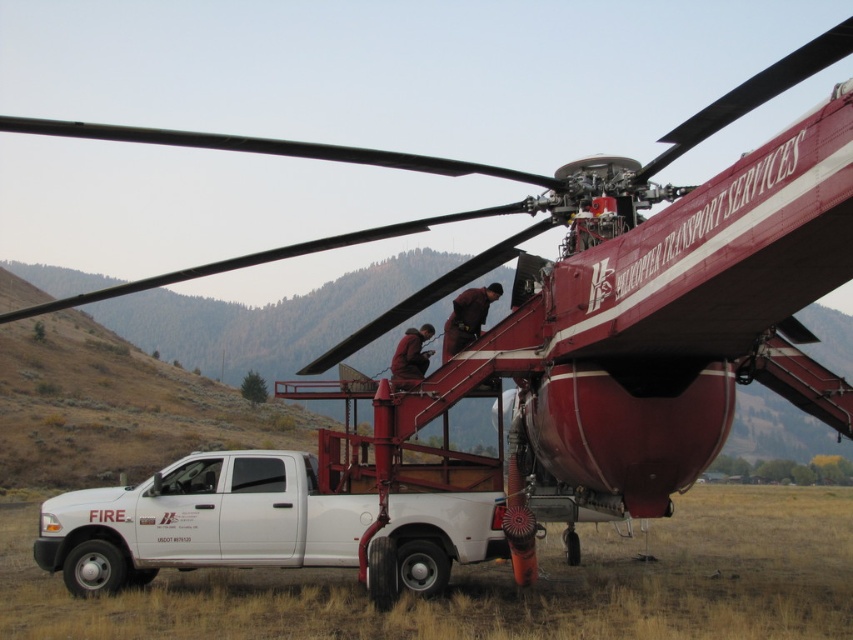
Question: Does dark brown leather jacket at center appear on the left side of brown fabric jacket at center?

Choices:
 (A) yes
 (B) no

Answer: (B)

Question: Which of the following is the farthest from the observer?

Choices:
 (A) brown fabric jacket at center
 (B) dark brown leather jacket at center
 (C) white matte truck at lower left

Answer: (B)

Question: Which is farther from the brown fabric jacket at center?

Choices:
 (A) white matte truck at lower left
 (B) dark brown leather jacket at center

Answer: (A)

Question: Where is white matte truck at lower left located in relation to brown fabric jacket at center in the image?

Choices:
 (A) below
 (B) above

Answer: (A)

Question: Is white matte truck at lower left bigger than dark brown leather jacket at center?

Choices:
 (A) no
 (B) yes

Answer: (B)

Question: Which is nearer to the brown fabric jacket at center?

Choices:
 (A) dark brown leather jacket at center
 (B) white matte truck at lower left

Answer: (A)